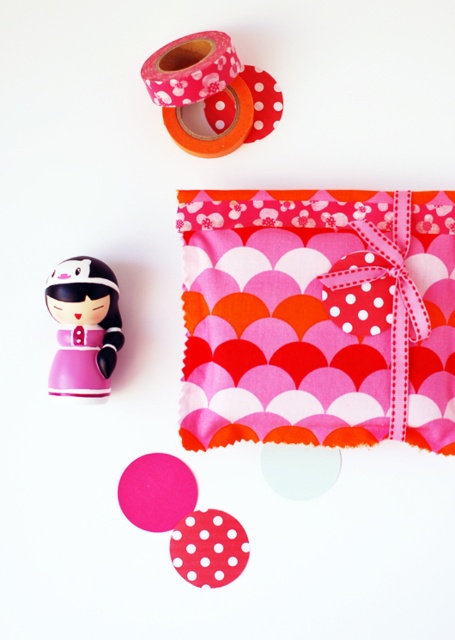
You are organizing a craft fair display and need to place the pink scalloped fabric at upper center and the polka dot paper at center. According to the image, which object is positioned higher?

The pink scalloped fabric at upper center is located above the polka dot paper at center, so it is positioned higher.

You are an interior designer planning to place a decorative item on a shelf. You have the pink matte washi tape at upper center and the wooden figurine. Which object is closer to the top edge of the shelf?

The pink matte washi tape at upper center is closer to the top edge of the shelf because its position is at point (211, 92), which is higher than the wooden figurine.